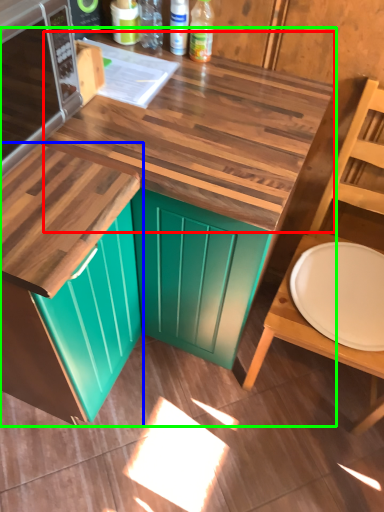
Question: Which object is positioned farthest from counter top (highlighted by a red box)? Select from cabinetry (highlighted by a blue box) and countertop (highlighted by a green box).

Choices:
 (A) cabinetry
 (B) countertop

Answer: (A)